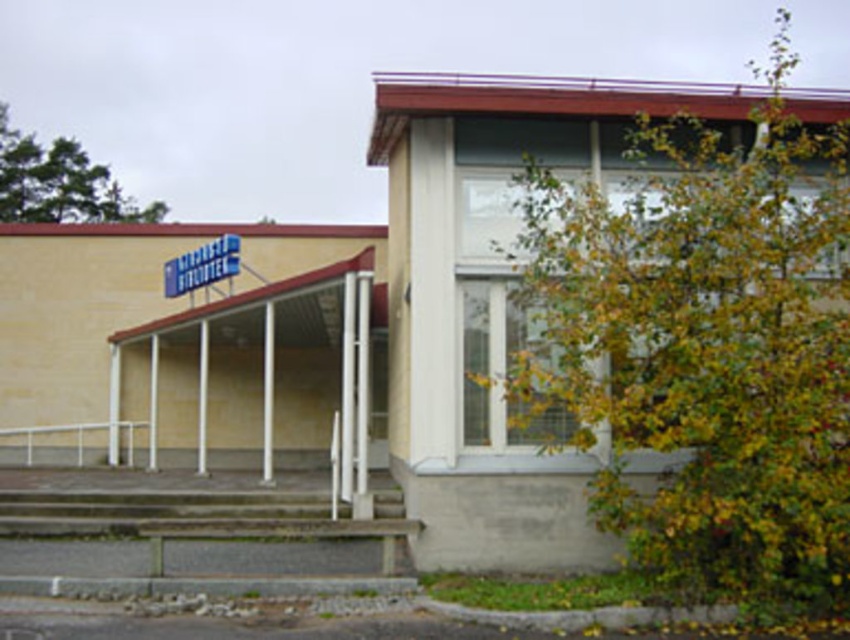
The width and height of the screenshot is (850, 640). What are the coordinates of `blue plastic sign at upper left` in the screenshot? It's located at (202, 266).

Describe the element at coordinates (202, 266) in the screenshot. I see `blue plastic sign at upper left` at that location.

Measure the distance between blue plastic sign at upper left and camera.

blue plastic sign at upper left and camera are 18.78 meters apart.

The image size is (850, 640). Find the location of `blue plastic sign at upper left`. blue plastic sign at upper left is located at coordinates (202, 266).